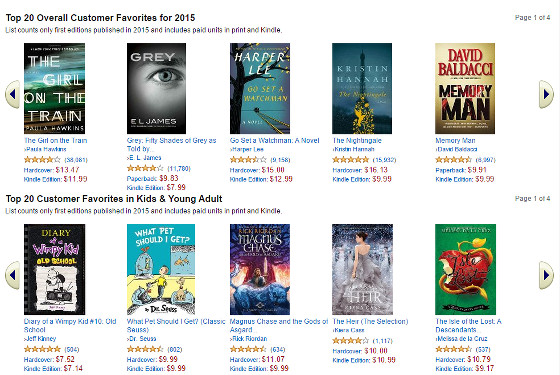
I want to click on books, so click(57, 91), click(157, 94), click(260, 84), click(370, 86), click(463, 87), click(477, 284), click(384, 265), click(268, 272), click(167, 274), click(46, 283).